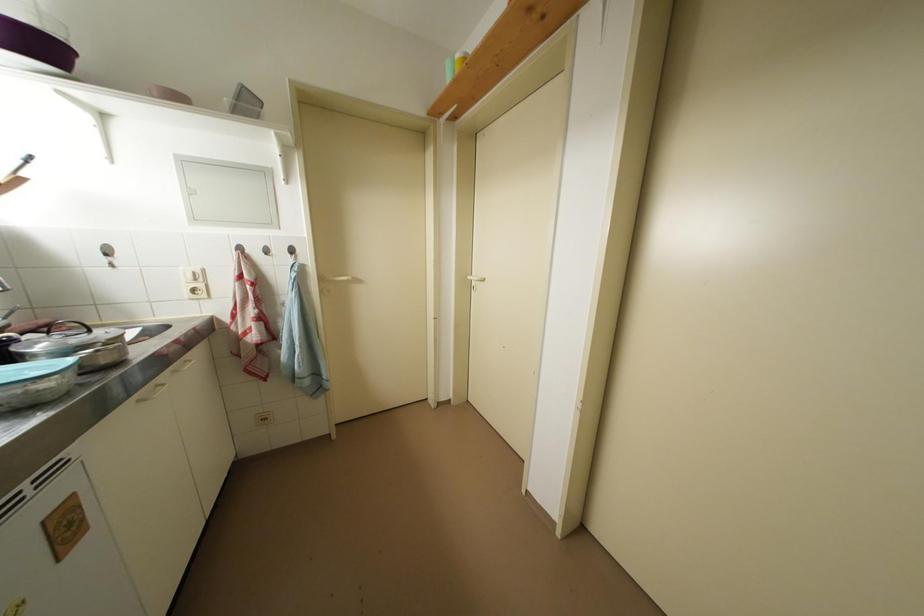
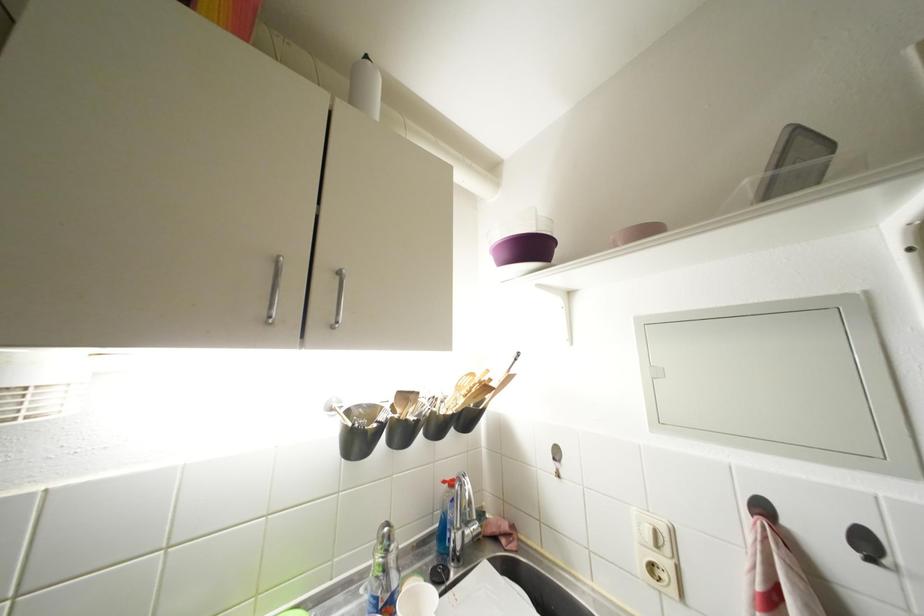
In the second image, find the point that corresponds to (x=112, y=264) in the first image.

(560, 469)